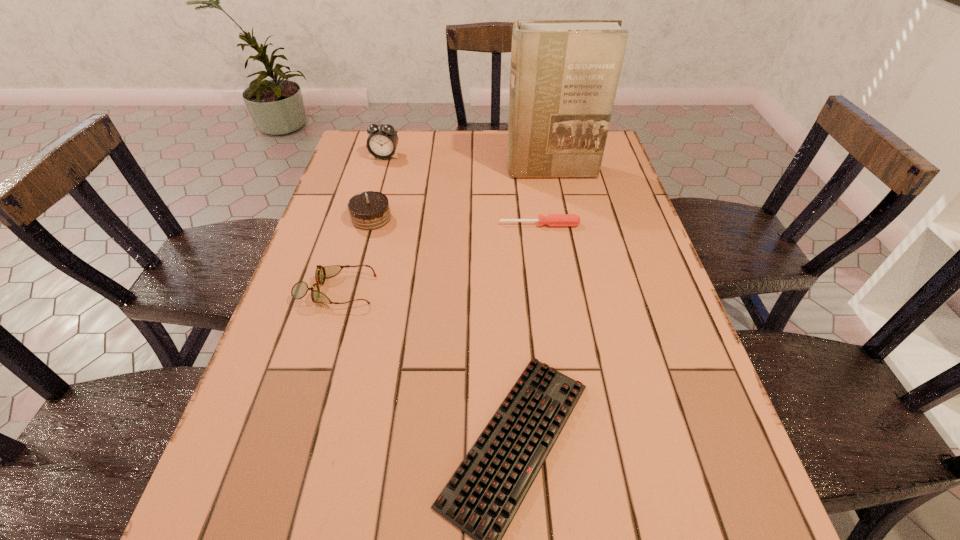
I want to click on vacant space situated 0.240m on the right of the fourth shortest object, so click(479, 218).

Locate an element on the screen. The height and width of the screenshot is (540, 960). free point located 0.240m on the front-facing side of the third shortest object is located at coordinates (479, 290).

What are the coordinates of `vacant space located on the back of the fifth tallest object` in the screenshot? It's located at click(x=528, y=148).

Where is `phonebook located in the far edge section of the desktop`? phonebook located in the far edge section of the desktop is located at coordinates (564, 74).

Locate an element on the screen. Image resolution: width=960 pixels, height=540 pixels. alarm clock that is at the far edge is located at coordinates (382, 141).

Identify the location of alarm clock located in the left edge section of the desktop. (382, 141).

This screenshot has width=960, height=540. I want to click on chocolate cake located in the left edge section of the desktop, so click(369, 210).

The image size is (960, 540). What are the coordinates of `spectacles present at the left edge` in the screenshot? It's located at (299, 290).

Image resolution: width=960 pixels, height=540 pixels. I want to click on phonebook at the right edge, so click(x=564, y=74).

The height and width of the screenshot is (540, 960). I want to click on screwdriver that is at the right edge, so click(x=552, y=220).